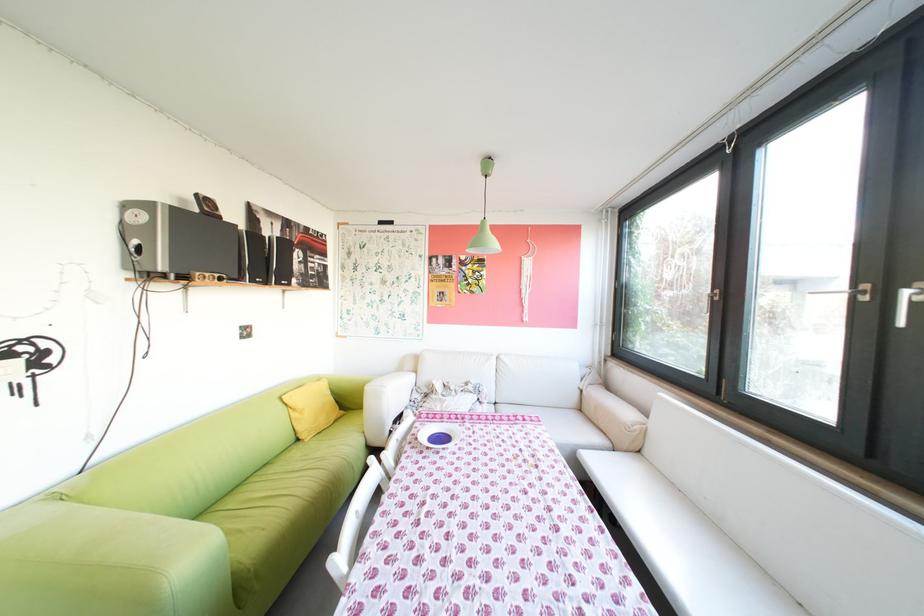
Describe the element at coordinates (134, 217) in the screenshot. I see `the speaker control dial` at that location.